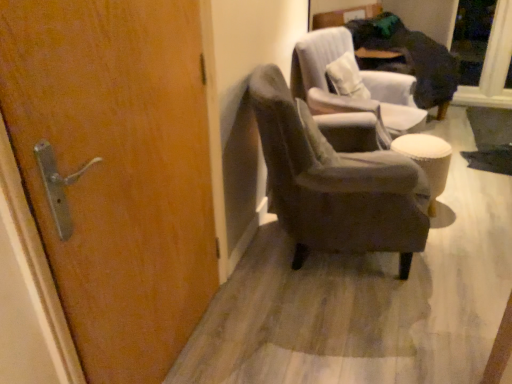
You are a GUI agent. You are given a task and a screenshot of the screen. Output one action in this format:
    pyautogui.click(x=<x>, y=<y>)
    Task: Click on the white fabric stool at right
    The height and width of the screenshot is (384, 512).
    Given the screenshot: What is the action you would take?
    pyautogui.click(x=426, y=160)

Locate an element on the screen. velvet gray armchair at center, placed as the 1th chair when sorted from front to back is located at coordinates (335, 183).

From the image's perspective, which one is positioned lower, wooden door at left or transparent glass door at upper right?

wooden door at left is shown below in the image.

Is point (29, 118) closer to camera compared to point (467, 1)?

Yes, point (29, 118) is closer to viewer.

Can you confirm if wooden door at left is taller than transparent glass door at upper right?

Indeed, wooden door at left has a greater height compared to transparent glass door at upper right.

Is transparent glass door at upper right surrounded by wooden door at left?

No, transparent glass door at upper right is not surrounded by wooden door at left.

From a real-world perspective, is white fabric stool at right above or below velvet gray armchair at center, placed as the 2th chair when sorted from back to front?

In terms of real-world spatial position, white fabric stool at right is below velvet gray armchair at center, placed as the 2th chair when sorted from back to front.

Considering the sizes of objects white fabric stool at right and velvet gray armchair at center, placed as the 1th chair when sorted from front to back, in the image provided, who is smaller, white fabric stool at right or velvet gray armchair at center, placed as the 1th chair when sorted from front to back,?

white fabric stool at right.

Is white fabric stool at right positioned beyond the bounds of velvet gray armchair at center, placed as the 1th chair when sorted from front to back?

Yes, white fabric stool at right is located beyond the bounds of velvet gray armchair at center, placed as the 1th chair when sorted from front to back.

Which is more to the right, white fabric stool at right or velvet gray armchair at center, placed as the 2th chair when sorted from back to front?

white fabric stool at right.

Is transparent glass door at upper right surrounding wooden door at left?

No, wooden door at left is not inside transparent glass door at upper right.

Can you confirm if transparent glass door at upper right is bigger than wooden door at left?

No.

Would you say transparent glass door at upper right is to the left or to the right of wooden door at left in the picture?

In the image, transparent glass door at upper right appears on the right side of wooden door at left.

Find the location of a particular element. chair located underneath the velvet gray armchair at center, placed as the 1th chair when sorted from front to back (from a real-world perspective) is located at coordinates (362, 82).

What's the angular difference between velvet gray armchair at center, which is the first chair in back-to-front order, and velvet gray armchair at center, placed as the 1th chair when sorted from front to back,'s facing directions?

The angular difference between velvet gray armchair at center, which is the first chair in back-to-front order, and velvet gray armchair at center, placed as the 1th chair when sorted from front to back, is 38.6 degrees.

Between velvet gray armchair at center, which is the first chair in back-to-front order, and velvet gray armchair at center, placed as the 2th chair when sorted from back to front, which one has larger width?

velvet gray armchair at center, placed as the 2th chair when sorted from back to front.

Which of these two, velvet gray armchair at center, placed as the 2th chair when sorted from back to front, or velvet gray armchair at center, which is the first chair in back-to-front order, is smaller?

velvet gray armchair at center, which is the first chair in back-to-front order.

Considering the positions of objects velvet gray armchair at center, placed as the 1th chair when sorted from front to back, and velvet gray armchair at center, which is the first chair in back-to-front order, in the image provided, who is more to the left, velvet gray armchair at center, placed as the 1th chair when sorted from front to back, or velvet gray armchair at center, which is the first chair in back-to-front order,?

Positioned to the left is velvet gray armchair at center, placed as the 1th chair when sorted from front to back.

You are a GUI agent. You are given a task and a screenshot of the screen. Output one action in this format:
    pyautogui.click(x=<x>, y=<y>)
    Task: Click on the chair below the velvet gray armchair at center, which is the first chair in back-to-front order (from the image's perspective)
    
    Given the screenshot: What is the action you would take?
    pyautogui.click(x=335, y=183)

Is point (255, 77) positioned after point (316, 77)?

No, it is in front of (316, 77).

From the picture: Is wooden door at left located within white fabric stool at right?

No, wooden door at left is located outside of white fabric stool at right.

Is white fabric stool at right positioned with its back to wooden door at left?

No, wooden door at left is not at the back of white fabric stool at right.

Who is more distant, white fabric stool at right or wooden door at left?

white fabric stool at right is further from the camera.

Is transparent glass door at upper right bigger or smaller than velvet gray armchair at center, placed as the 2th chair when sorted from back to front?

In the image, transparent glass door at upper right appears to be smaller than velvet gray armchair at center, placed as the 2th chair when sorted from back to front.

Where is `glass door lying behind the velvet gray armchair at center, placed as the 2th chair when sorted from back to front`? glass door lying behind the velvet gray armchair at center, placed as the 2th chair when sorted from back to front is located at coordinates (472, 37).

Is transparent glass door at upper right with velvet gray armchair at center, placed as the 1th chair when sorted from front to back?

transparent glass door at upper right is not next to velvet gray armchair at center, placed as the 1th chair when sorted from front to back, and they're not touching.

How far apart are transparent glass door at upper right and velvet gray armchair at center, placed as the 1th chair when sorted from front to back?

The distance of transparent glass door at upper right from velvet gray armchair at center, placed as the 1th chair when sorted from front to back, is 2.95 meters.

The width and height of the screenshot is (512, 384). Identify the location of door that appears above the transparent glass door at upper right (from a real-world perspective). (117, 170).

Where is `stool lying behind the velvet gray armchair at center, placed as the 1th chair when sorted from front to back`? The height and width of the screenshot is (384, 512). stool lying behind the velvet gray armchair at center, placed as the 1th chair when sorted from front to back is located at coordinates (426, 160).

Based on their spatial positions, is velvet gray armchair at center, placed as the 1th chair when sorted from front to back, or wooden door at left closer to white fabric stool at right?

velvet gray armchair at center, placed as the 1th chair when sorted from front to back, is closer to white fabric stool at right.

Looking at the image, which one is located further to transparent glass door at upper right, wooden door at left or velvet gray armchair at center, which appears as the 2th chair when viewed from the front?

wooden door at left is further to transparent glass door at upper right.

In the scene shown: From the image, which object appears to be nearer to white fabric stool at right, wooden door at left or velvet gray armchair at center, which appears as the 2th chair when viewed from the front?

velvet gray armchair at center, which appears as the 2th chair when viewed from the front, is positioned closer to the anchor white fabric stool at right.

Based on their spatial positions, is wooden door at left or white fabric stool at right closer to velvet gray armchair at center, placed as the 1th chair when sorted from front to back?

Among the two, white fabric stool at right is located nearer to velvet gray armchair at center, placed as the 1th chair when sorted from front to back.

From the image, which object appears to be farther from velvet gray armchair at center, placed as the 2th chair when sorted from back to front, transparent glass door at upper right or wooden door at left?

transparent glass door at upper right lies further to velvet gray armchair at center, placed as the 2th chair when sorted from back to front, than the other object.

From the image, which object appears to be nearer to velvet gray armchair at center, which is the first chair in back-to-front order, white fabric stool at right or wooden door at left?

white fabric stool at right lies closer to velvet gray armchair at center, which is the first chair in back-to-front order, than the other object.

Which object lies further to the anchor point wooden door at left, transparent glass door at upper right or white fabric stool at right?

The object further to wooden door at left is transparent glass door at upper right.

From the image, which object appears to be farther from velvet gray armchair at center, which appears as the 2th chair when viewed from the front, wooden door at left or velvet gray armchair at center, placed as the 1th chair when sorted from front to back?

Based on the image, wooden door at left appears to be further to velvet gray armchair at center, which appears as the 2th chair when viewed from the front.

You are a GUI agent. You are given a task and a screenshot of the screen. Output one action in this format:
    pyautogui.click(x=<x>, y=<y>)
    Task: Click on the chair between velvet gray armchair at center, placed as the 1th chair when sorted from front to back, and white fabric stool at right from front to back
    Image resolution: width=512 pixels, height=384 pixels.
    Given the screenshot: What is the action you would take?
    pyautogui.click(x=362, y=82)

This screenshot has width=512, height=384. Find the location of `stool between velvet gray armchair at center, placed as the 2th chair when sorted from back to front, and transparent glass door at upper right from front to back`. stool between velvet gray armchair at center, placed as the 2th chair when sorted from back to front, and transparent glass door at upper right from front to back is located at coordinates (426, 160).

Identify the location of stool between wooden door at left and transparent glass door at upper right from front to back. (426, 160).

The image size is (512, 384). Find the location of `stool located between velvet gray armchair at center, which is the first chair in back-to-front order, and transparent glass door at upper right in the depth direction`. stool located between velvet gray armchair at center, which is the first chair in back-to-front order, and transparent glass door at upper right in the depth direction is located at coordinates (426, 160).